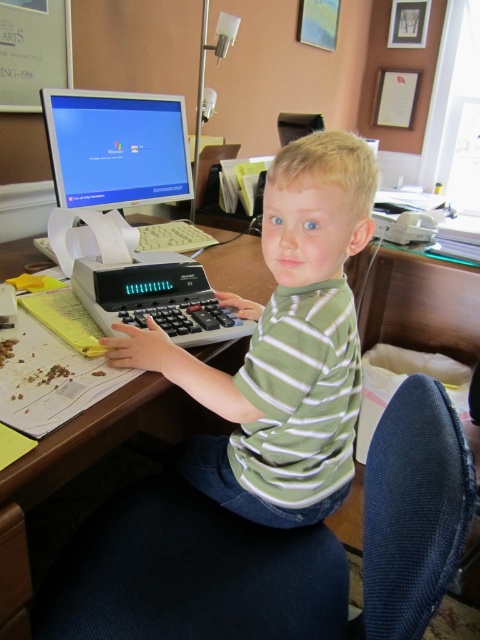
You are a student who needs to use both the matte plastic monitor at upper left and the gray plastic calculator at lower left. Which object is taller?

The matte plastic monitor at upper left is much taller than the gray plastic calculator at lower left.

You are a delivery person who needs to place a small package on the desk without blocking the receipt printer. The package must be placed between the green striped shirt at center and the gray plastic calculator at lower left. Is there enough space between them to fit the package?

The distance between the green striped shirt at center and the gray plastic calculator at lower left is 6.95 inches. Since the package is small, it should fit comfortably within this space without blocking the receipt printer.